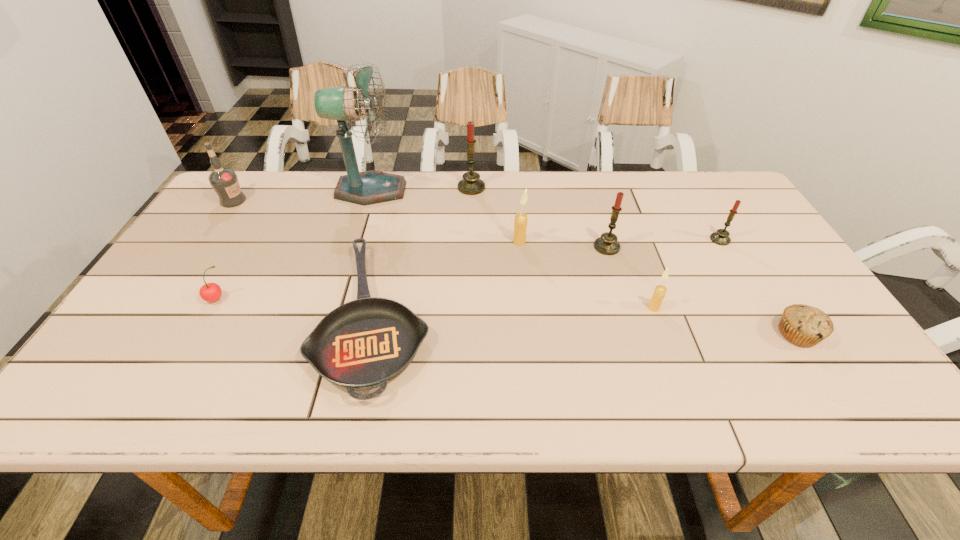
This screenshot has height=540, width=960. In order to click on vacant space situated on the front label of the vodka in this screenshot , I will do `click(352, 200)`.

This screenshot has height=540, width=960. What are the coordinates of `vacant region located 0.050m on the back of the second red candle from left to right` in the screenshot? It's located at (601, 227).

I want to click on free region located on the front of the farther cream candle, so click(x=522, y=268).

Locate an element on the screen. free space located 0.120m on the back of the rightmost candle is located at coordinates (702, 208).

Image resolution: width=960 pixels, height=540 pixels. Find the location of `free space located 0.230m on the right of the third object from right to left`. free space located 0.230m on the right of the third object from right to left is located at coordinates (756, 308).

At what (x,y) coordinates should I click in order to perform the action: click on free spot located on the back of the ninth object from right to left. Please return your answer as a coordinate pair (x, y). Looking at the image, I should click on (261, 222).

At what (x,y) coordinates should I click in order to perform the action: click on vacant position located 0.360m on the left of the muffin. Please return your answer as a coordinate pair (x, y). This screenshot has width=960, height=540. Looking at the image, I should click on (617, 334).

You are a GUI agent. You are given a task and a screenshot of the screen. Output one action in this format:
    pyautogui.click(x=<x>, y=<y>)
    Task: Click on the vacant region located on the right of the frying pan
    This screenshot has height=540, width=960.
    Given the screenshot: What is the action you would take?
    pyautogui.click(x=560, y=316)

Image resolution: width=960 pixels, height=540 pixels. I want to click on fan at the far edge, so click(343, 104).

This screenshot has width=960, height=540. Identify the location of candle located in the far edge section of the desktop. (470, 184).